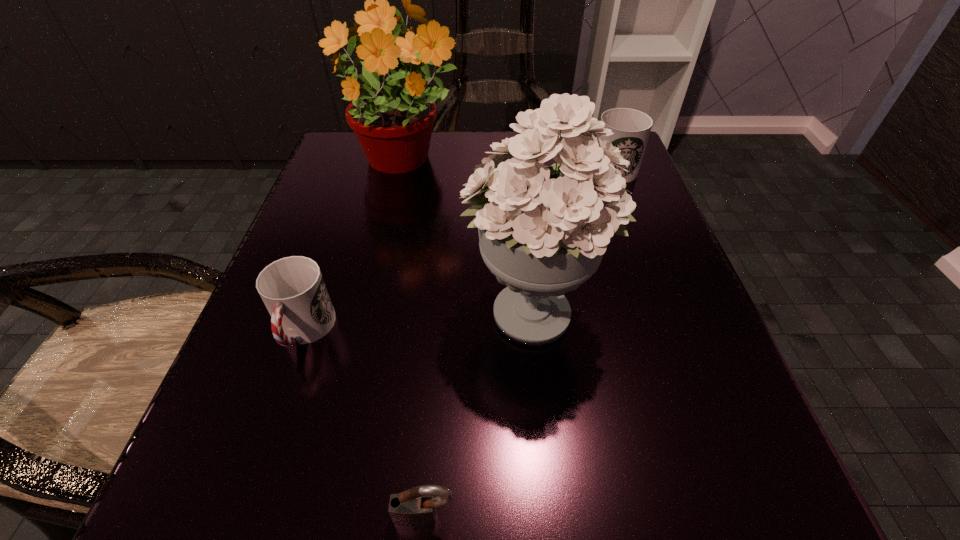
What are the coordinates of `unoccupied position between the nearest object and the right cup` in the screenshot? It's located at (515, 343).

This screenshot has height=540, width=960. In order to click on vacant area that lies between the nearer cup and the flowerpot in this screenshot , I will do `click(353, 247)`.

You are a GUI agent. You are given a task and a screenshot of the screen. Output one action in this format:
    pyautogui.click(x=<x>, y=<y>)
    Task: Click on the free space between the padlock and the nearer cup
    The width and height of the screenshot is (960, 540).
    Given the screenshot: What is the action you would take?
    pyautogui.click(x=365, y=424)

You are a GUI agent. You are given a task and a screenshot of the screen. Output one action in this format:
    pyautogui.click(x=<x>, y=<y>)
    Task: Click on the vacant space in between the nearer cup and the nearest object
    The image size is (960, 540).
    Given the screenshot: What is the action you would take?
    pyautogui.click(x=365, y=424)

Where is `object that is the closest to the flowerpot`? object that is the closest to the flowerpot is located at coordinates (543, 230).

Point out which object is positioned as the nearest to the flowerpot. Please provide its 2D coordinates. Your answer should be formatted as a tuple, i.e. [(x, y)], where the tuple contains the x and y coordinates of a point satisfying the conditions above.

[(543, 230)]